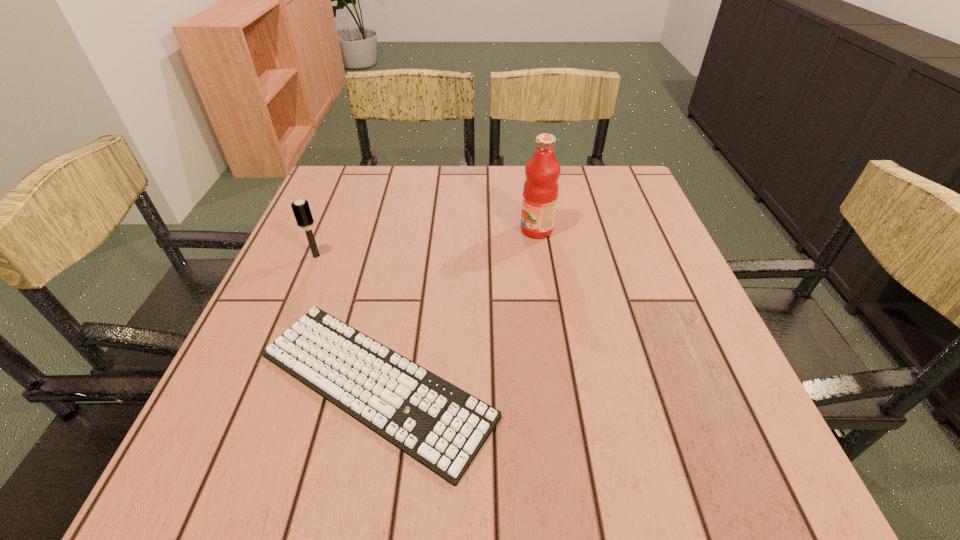
Locate an element on the screen. Image resolution: width=960 pixels, height=540 pixels. unoccupied position between the second shortest object and the rightmost object is located at coordinates (426, 243).

The height and width of the screenshot is (540, 960). I want to click on the closest object relative to the tallest object, so click(441, 426).

Choose which object is the second nearest neighbor to the tallest object. Please provide its 2D coordinates. Your answer should be formatted as a tuple, i.e. [(x, y)], where the tuple contains the x and y coordinates of a point satisfying the conditions above.

[(301, 209)]

You are a GUI agent. You are given a task and a screenshot of the screen. Output one action in this format:
    pyautogui.click(x=<x>, y=<y>)
    Task: Click on the vacant position in the image that satisfies the following two spatial constraints: 1. on the front label of the fruit juice; 2. on the front side of the hairbrush
    Image resolution: width=960 pixels, height=540 pixels.
    Given the screenshot: What is the action you would take?
    pyautogui.click(x=540, y=256)

Where is `free space that satisfies the following two spatial constraints: 1. on the front label of the fruit juice; 2. on the front side of the second shortest object`? free space that satisfies the following two spatial constraints: 1. on the front label of the fruit juice; 2. on the front side of the second shortest object is located at coordinates (540, 256).